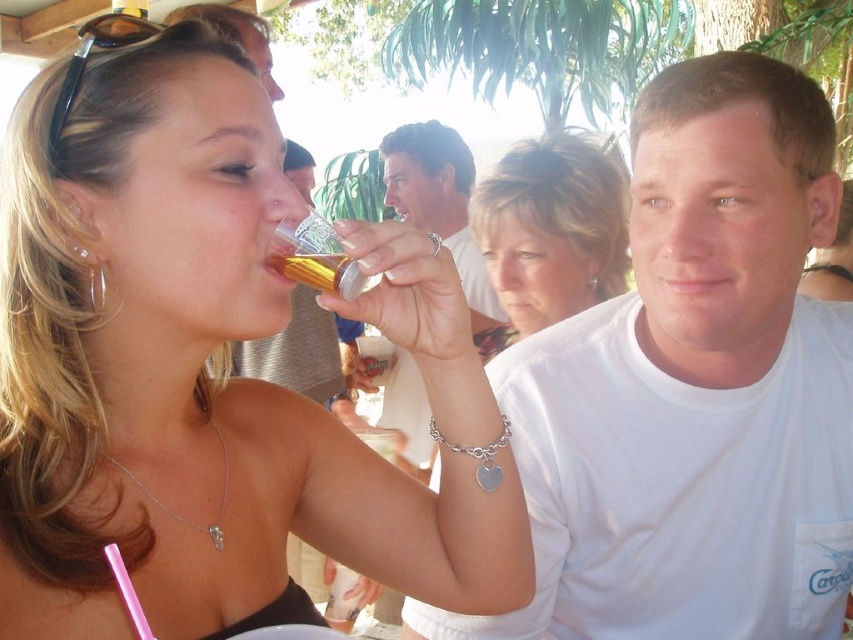
You are at a party and want to choose a drink that is taller than the other. Which one should you pick between the matte black glass at upper left and the gold metallic can at upper center?

The matte black glass at upper left is taller than the gold metallic can at upper center, so you should pick the matte black glass at upper left.

In the scene shown: You are a photographer at the event and want to capture a photo of the white matte shirt at center and the smooth silver ring at center. Which object should you focus on first if you want to ensure both are in sharp focus?

The white matte shirt at center is located below the smooth silver ring at center. Since they are at the same distance from the camera, both will be in focus if the photographer focuses on either one.